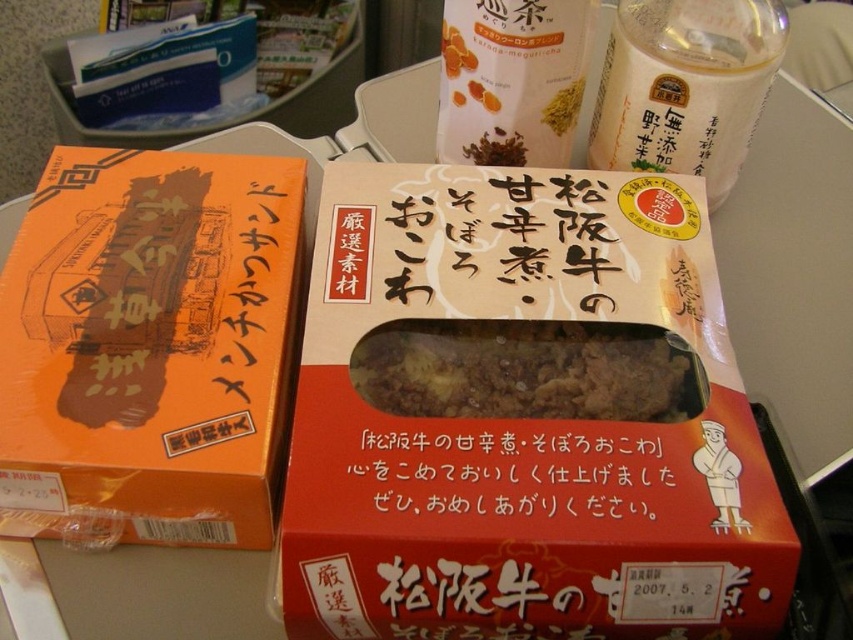
Which of these two, orange matte/metallic box at left or white matte bottle at upper center, stands shorter?

white matte bottle at upper center

Does point (132, 497) come farther from viewer compared to point (473, 124)?

No.

Where is `orange matte/metallic box at left`? orange matte/metallic box at left is located at coordinates (148, 348).

Does brown crumbly rice at center appear under white matte bottle at upper center?

Correct, brown crumbly rice at center is located below white matte bottle at upper center.

Does point (672, 371) come closer to viewer compared to point (526, 67)?

That is True.

What are the coordinates of `brown crumbly rice at center` in the screenshot? It's located at pyautogui.click(x=527, y=371).

Can you confirm if matte cardboard box at center is positioned to the left of white matte bottle at upper right?

Yes, matte cardboard box at center is to the left of white matte bottle at upper right.

Which is more to the right, matte cardboard box at center or white matte bottle at upper right?

From the viewer's perspective, white matte bottle at upper right appears more on the right side.

Who is more distant from viewer, (560, 614) or (656, 10)?

Point (656, 10)

Locate an element on the screen. The width and height of the screenshot is (853, 640). matte cardboard box at center is located at coordinates (523, 417).